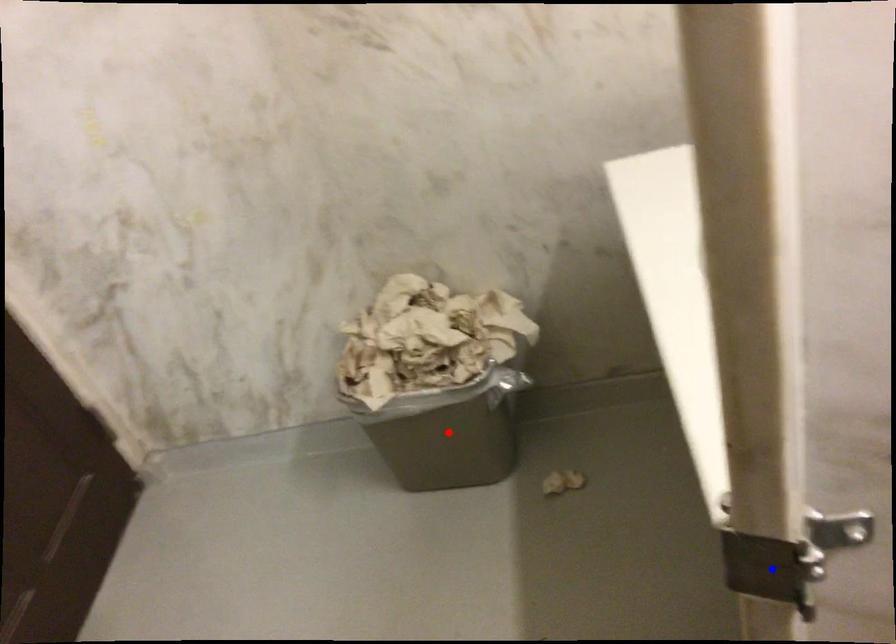
Question: In the image, two points are highlighted. Which point is nearer to the camera? Reply with the corresponding letter.

Choices:
 (A) blue point
 (B) red point

Answer: (A)